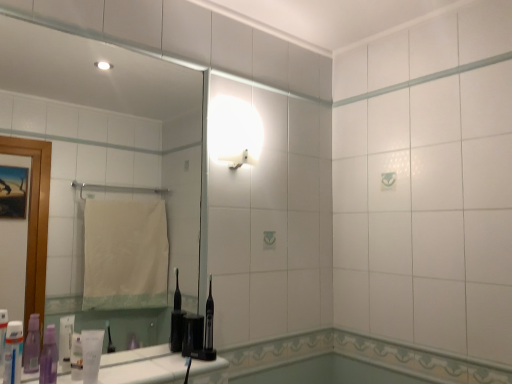
What is the approximate width of clear glass mirror at upper left?

It is 1.68 inches.

I want to click on white glossy light fixture at upper center, so click(234, 132).

The image size is (512, 384). What do you see at coordinates (76, 357) in the screenshot?
I see `translucent plastic toothpaste tube at lower left, which is the second toiletry from right to left` at bounding box center [76, 357].

What do you see at coordinates (91, 354) in the screenshot? I see `white matte tube at lower left, acting as the first toiletry starting from the right` at bounding box center [91, 354].

This screenshot has height=384, width=512. I want to click on clear glass mirror at upper left, so click(106, 161).

Is point (41, 358) positioned after point (85, 379)?

Yes, point (41, 358) is behind point (85, 379).

From a real-world perspective, who is located higher, purple plastic toothpaste at lower left, the third toiletry in the right-to-left sequence, or white matte tube at lower left, acting as the first toiletry starting from the right?

In real-world perspective, purple plastic toothpaste at lower left, the third toiletry in the right-to-left sequence, is above.

From the image's perspective, would you say purple plastic toothpaste at lower left, the 2th toiletry viewed from the left, is positioned over white matte tube at lower left, acting as the 4th toiletry starting from the left?

Yes, from the image's perspective, purple plastic toothpaste at lower left, the 2th toiletry viewed from the left, is over white matte tube at lower left, acting as the 4th toiletry starting from the left.

Is purple plastic toothpaste at lower left, the third toiletry in the right-to-left sequence, facing towards white matte tube at lower left, acting as the 4th toiletry starting from the left?

No, purple plastic toothpaste at lower left, the third toiletry in the right-to-left sequence, is not aimed at white matte tube at lower left, acting as the 4th toiletry starting from the left.

Between translucent plastic toothpaste tube at lower left, the first toiletry in the left-to-right sequence, and white matte tube at lower left, acting as the 4th toiletry starting from the left, which one appears on the right side from the viewer's perspective?

Positioned to the right is white matte tube at lower left, acting as the 4th toiletry starting from the left.

From the image's perspective, is translucent plastic toothpaste tube at lower left, the first toiletry in the left-to-right sequence, above or below white matte tube at lower left, acting as the first toiletry starting from the right?

translucent plastic toothpaste tube at lower left, the first toiletry in the left-to-right sequence, is above white matte tube at lower left, acting as the first toiletry starting from the right.

Can we say translucent plastic toothpaste tube at lower left, the 4th toiletry viewed from the right, lies outside white matte tube at lower left, acting as the first toiletry starting from the right?

That's correct, translucent plastic toothpaste tube at lower left, the 4th toiletry viewed from the right, is outside of white matte tube at lower left, acting as the first toiletry starting from the right.

Is translucent plastic toothpaste tube at lower left, which is the second toiletry from right to left, a part of translucent plastic toothpaste tube at lower left, the 4th toiletry viewed from the right?

Actually, translucent plastic toothpaste tube at lower left, which is the second toiletry from right to left, is outside translucent plastic toothpaste tube at lower left, the 4th toiletry viewed from the right.

Is translucent plastic toothpaste tube at lower left, the first toiletry in the left-to-right sequence, shorter than translucent plastic toothpaste tube at lower left, which is the second toiletry from right to left?

Incorrect, the height of translucent plastic toothpaste tube at lower left, the first toiletry in the left-to-right sequence, does not fall short of that of translucent plastic toothpaste tube at lower left, which is the second toiletry from right to left.

From the image's perspective, between translucent plastic toothpaste tube at lower left, the 4th toiletry viewed from the right, and translucent plastic toothpaste tube at lower left, which is the second toiletry from right to left, who is located below?

translucent plastic toothpaste tube at lower left, which is the second toiletry from right to left, is shown below in the image.

Considering the relative positions of translucent plastic toothpaste tube at lower left, which is the second toiletry from right to left, and white matte tube at lower left, acting as the 4th toiletry starting from the left, in the image provided, is translucent plastic toothpaste tube at lower left, which is the second toiletry from right to left, to the left of white matte tube at lower left, acting as the 4th toiletry starting from the left, from the viewer's perspective?

Indeed, translucent plastic toothpaste tube at lower left, which is the second toiletry from right to left, is positioned on the left side of white matte tube at lower left, acting as the 4th toiletry starting from the left.

What's the angular difference between translucent plastic toothpaste tube at lower left, which is the second toiletry from right to left, and white matte tube at lower left, acting as the first toiletry starting from the right,'s facing directions?

The facing directions of translucent plastic toothpaste tube at lower left, which is the second toiletry from right to left, and white matte tube at lower left, acting as the first toiletry starting from the right, are 50.4 degrees apart.

Looking at this image, is translucent plastic toothpaste tube at lower left, marked as the third toiletry in a left-to-right arrangement, bigger or smaller than white matte tube at lower left, acting as the first toiletry starting from the right?

In the image, translucent plastic toothpaste tube at lower left, marked as the third toiletry in a left-to-right arrangement, appears to be smaller than white matte tube at lower left, acting as the first toiletry starting from the right.

In terms of height, does translucent plastic toothpaste tube at lower left, marked as the third toiletry in a left-to-right arrangement, look taller or shorter compared to white matte tube at lower left, acting as the first toiletry starting from the right?

translucent plastic toothpaste tube at lower left, marked as the third toiletry in a left-to-right arrangement, is shorter than white matte tube at lower left, acting as the first toiletry starting from the right.

Between clear glass mirror at upper left and translucent plastic toothpaste tube at lower left, the first toiletry in the left-to-right sequence, which one is positioned behind?

clear glass mirror at upper left is more distant.

Considering the relative sizes of clear glass mirror at upper left and translucent plastic toothpaste tube at lower left, the 4th toiletry viewed from the right, in the image provided, is clear glass mirror at upper left smaller than translucent plastic toothpaste tube at lower left, the 4th toiletry viewed from the right,?

Actually, clear glass mirror at upper left might be larger than translucent plastic toothpaste tube at lower left, the 4th toiletry viewed from the right.

Which object is positioned more to the right, clear glass mirror at upper left or translucent plastic toothpaste tube at lower left, the first toiletry in the left-to-right sequence?

Positioned to the right is clear glass mirror at upper left.

Is clear glass mirror at upper left next to translucent plastic toothpaste tube at lower left, the first toiletry in the left-to-right sequence?

clear glass mirror at upper left and translucent plastic toothpaste tube at lower left, the first toiletry in the left-to-right sequence, are clearly separated.

Where is `the 1st toiletry to the left when counting from the white glossy light fixture at upper center`? the 1st toiletry to the left when counting from the white glossy light fixture at upper center is located at coordinates (91, 354).

Does white glossy light fixture at upper center lie in front of white matte tube at lower left, acting as the 4th toiletry starting from the left?

That is False.

Is white matte tube at lower left, acting as the 4th toiletry starting from the left, located within white glossy light fixture at upper center?

No, white glossy light fixture at upper center does not contain white matte tube at lower left, acting as the 4th toiletry starting from the left.

From a real-world perspective, relative to translucent plastic toothpaste tube at lower left, which is the second toiletry from right to left, is white matte tube at lower left, acting as the 4th toiletry starting from the left, vertically above or below?

From a real-world perspective, white matte tube at lower left, acting as the 4th toiletry starting from the left, is physically above translucent plastic toothpaste tube at lower left, which is the second toiletry from right to left.

Does white matte tube at lower left, acting as the first toiletry starting from the right, have a greater height compared to translucent plastic toothpaste tube at lower left, which is the second toiletry from right to left?

Yes.

Is white matte tube at lower left, acting as the first toiletry starting from the right, far from translucent plastic toothpaste tube at lower left, which is the second toiletry from right to left?

white matte tube at lower left, acting as the first toiletry starting from the right, is near translucent plastic toothpaste tube at lower left, which is the second toiletry from right to left, not far away.

Identify the location of the 1st toiletry positioned below the purple plastic toothpaste at lower left, the third toiletry in the right-to-left sequence (from the image's perspective). The width and height of the screenshot is (512, 384). (91, 354).

Image resolution: width=512 pixels, height=384 pixels. In order to click on toiletry that is the 2nd object located behind the translucent plastic toothpaste tube at lower left, the first toiletry in the left-to-right sequence in this screenshot , I will do tap(91, 354).

From the image, which object appears to be farther from purple plastic toothpaste at lower left, the 2th toiletry viewed from the left, white matte tube at lower left, acting as the first toiletry starting from the right, or translucent plastic toothpaste tube at lower left, marked as the third toiletry in a left-to-right arrangement?

white matte tube at lower left, acting as the first toiletry starting from the right, lies further to purple plastic toothpaste at lower left, the 2th toiletry viewed from the left, than the other object.

From the image, which object appears to be nearer to translucent plastic toothpaste tube at lower left, which is the second toiletry from right to left, white glossy light fixture at upper center or purple plastic toothpaste at lower left, the third toiletry in the right-to-left sequence?

Among the two, purple plastic toothpaste at lower left, the third toiletry in the right-to-left sequence, is located nearer to translucent plastic toothpaste tube at lower left, which is the second toiletry from right to left.

Which object lies nearer to the anchor point clear glass mirror at upper left, white glossy light fixture at upper center or purple plastic toothpaste at lower left, the third toiletry in the right-to-left sequence?

white glossy light fixture at upper center is closer to clear glass mirror at upper left.

Estimate the real-world distances between objects in this image. Which object is further from white glossy light fixture at upper center, translucent plastic toothpaste tube at lower left, which is the second toiletry from right to left, or white matte tube at lower left, acting as the first toiletry starting from the right?

Among the two, translucent plastic toothpaste tube at lower left, which is the second toiletry from right to left, is located further to white glossy light fixture at upper center.

Considering their positions, is white glossy light fixture at upper center positioned closer to translucent plastic toothpaste tube at lower left, the first toiletry in the left-to-right sequence, than purple plastic toothpaste at lower left, the third toiletry in the right-to-left sequence?

Based on the image, purple plastic toothpaste at lower left, the third toiletry in the right-to-left sequence, appears to be nearer to translucent plastic toothpaste tube at lower left, the first toiletry in the left-to-right sequence.

Estimate the real-world distances between objects in this image. Which object is further from purple plastic toothpaste at lower left, the 2th toiletry viewed from the left, clear glass mirror at upper left or translucent plastic toothpaste tube at lower left, marked as the third toiletry in a left-to-right arrangement?

Based on the image, clear glass mirror at upper left appears to be further to purple plastic toothpaste at lower left, the 2th toiletry viewed from the left.

Estimate the real-world distances between objects in this image. Which object is closer to white glossy light fixture at upper center, white matte tube at lower left, acting as the first toiletry starting from the right, or translucent plastic toothpaste tube at lower left, the 4th toiletry viewed from the right?

Based on the image, white matte tube at lower left, acting as the first toiletry starting from the right, appears to be nearer to white glossy light fixture at upper center.

Looking at this image, from the image, which object appears to be farther from white glossy light fixture at upper center, translucent plastic toothpaste tube at lower left, marked as the third toiletry in a left-to-right arrangement, or purple plastic toothpaste at lower left, the 2th toiletry viewed from the left?

purple plastic toothpaste at lower left, the 2th toiletry viewed from the left.

Locate an element on the screen. toiletry between white glossy light fixture at upper center and purple plastic toothpaste at lower left, the 2th toiletry viewed from the left, from top to bottom is located at coordinates (13, 352).

The width and height of the screenshot is (512, 384). I want to click on mirror that lies between white glossy light fixture at upper center and purple plastic toothpaste at lower left, the 2th toiletry viewed from the left, from top to bottom, so click(x=106, y=161).

This screenshot has height=384, width=512. Find the location of `mirror that lies between white glossy light fixture at upper center and white matte tube at lower left, acting as the first toiletry starting from the right, from top to bottom`. mirror that lies between white glossy light fixture at upper center and white matte tube at lower left, acting as the first toiletry starting from the right, from top to bottom is located at coordinates (106, 161).

I want to click on mirror that lies between white glossy light fixture at upper center and translucent plastic toothpaste tube at lower left, the first toiletry in the left-to-right sequence, from top to bottom, so click(x=106, y=161).